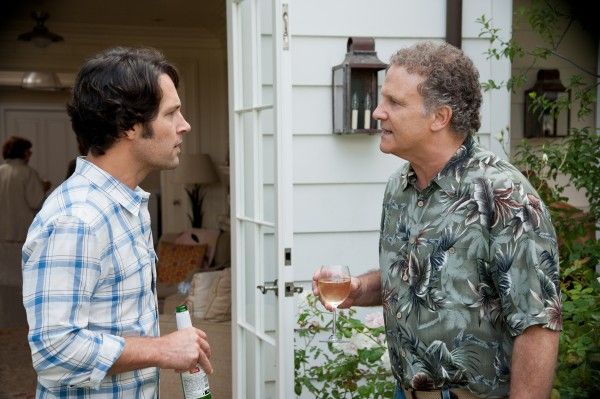
Find the location of a particular element. The height and width of the screenshot is (399, 600). ceiling light is located at coordinates (43, 40).